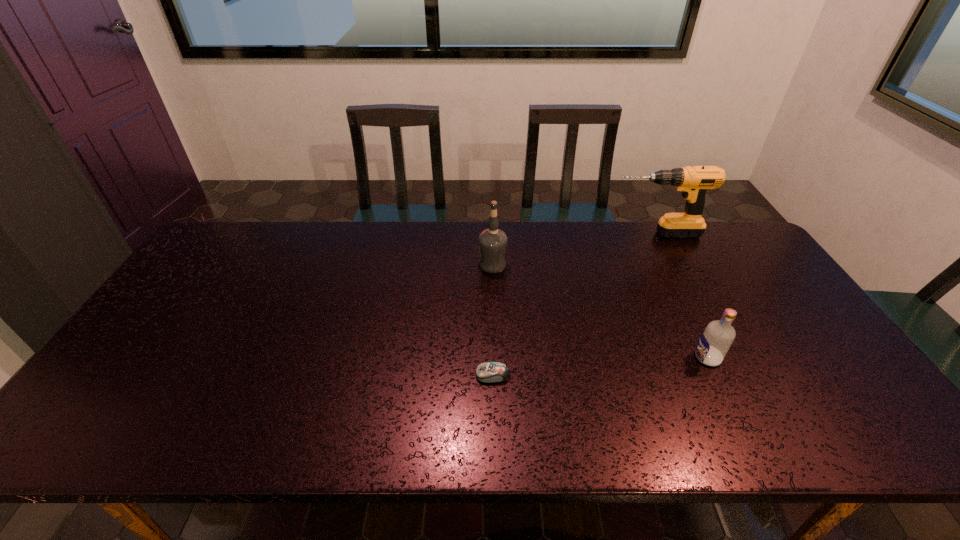
The width and height of the screenshot is (960, 540). Find the location of `object that is at the right edge`. object that is at the right edge is located at coordinates (694, 181).

In order to click on object that is at the far right corner in this screenshot , I will do `click(694, 181)`.

The image size is (960, 540). I want to click on free space at the far edge of the desktop, so click(x=321, y=247).

Identify the location of vacant space at the near edge. (751, 443).

Find the location of `vacant space at the left edge`. vacant space at the left edge is located at coordinates (179, 286).

This screenshot has height=540, width=960. Find the location of `vacant space at the right edge`. vacant space at the right edge is located at coordinates (841, 403).

I want to click on free spot at the far left corner of the desktop, so click(203, 265).

Locate an element on the screen. Image resolution: width=960 pixels, height=540 pixels. vacant region at the far right corner of the desktop is located at coordinates (732, 250).

Locate an element on the screen. This screenshot has height=540, width=960. empty space that is in between the computer mouse and the second farthest object is located at coordinates (492, 320).

I want to click on vacant space that is in between the drill and the computer mouse, so click(x=574, y=304).